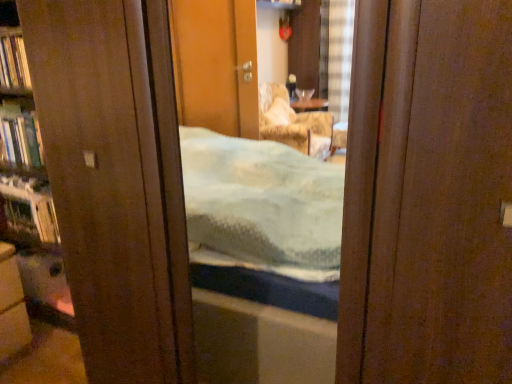
Question: From their relative heights in the image, would you say matte brown cabinet at lower left is taller or shorter than hardcover book at left, the second book ordered from the bottom?

Choices:
 (A) short
 (B) tall

Answer: (B)

Question: Considering the relative positions of matte brown cabinet at lower left and hardcover book at left, the 1th book from the top, in the image provided, is matte brown cabinet at lower left to the left or to the right of hardcover book at left, the 1th book from the top,?

Choices:
 (A) right
 (B) left

Answer: (A)

Question: Estimate the real-world distances between objects in this image. Which object is closer to the matte brown cabinet at lower left?

Choices:
 (A) hardcover book at left, the second book ordered from the bottom
 (B) hardcover book at left, marked as the 1th book in a bottom-to-top arrangement
 (C) metallic silver shelf at left

Answer: (C)

Question: Which object is positioned farthest from the matte brown cabinet at lower left?

Choices:
 (A) hardcover book at left, the second book ordered from the bottom
 (B) metallic silver shelf at left
 (C) hardcover book at left, acting as the 2th book starting from the top

Answer: (A)